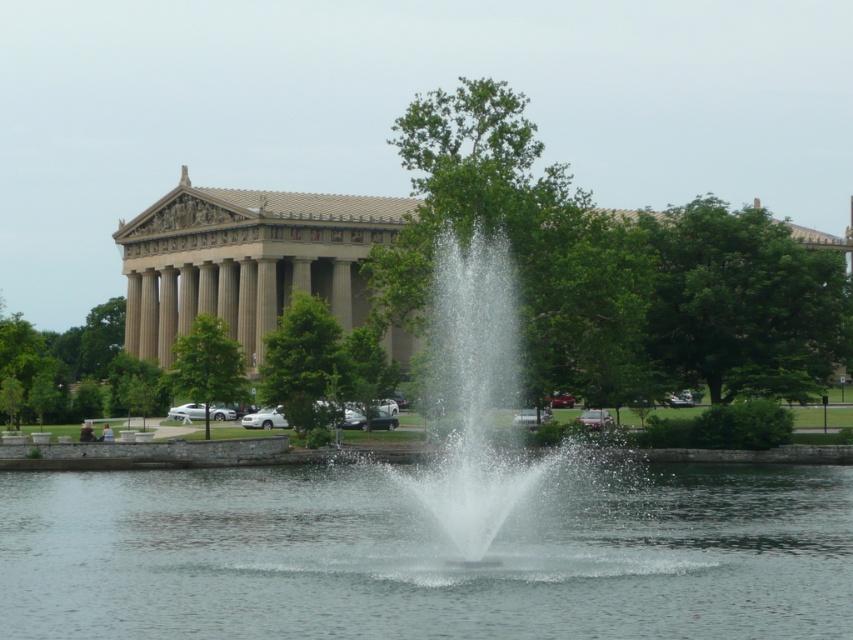
Question: In this image, where is clear water at center located relative to clear water fountain at center?

Choices:
 (A) left
 (B) right

Answer: (A)

Question: Can you confirm if clear water at center is thinner than clear water fountain at center?

Choices:
 (A) no
 (B) yes

Answer: (A)

Question: Which point is farther from the camera taking this photo?

Choices:
 (A) (746, 561)
 (B) (502, 332)

Answer: (B)

Question: Which point is closer to the camera?

Choices:
 (A) (589, 515)
 (B) (471, 444)

Answer: (B)

Question: Does clear water at center have a lesser width compared to clear water fountain at center?

Choices:
 (A) no
 (B) yes

Answer: (A)